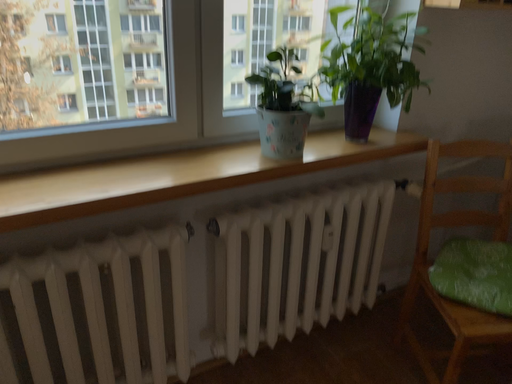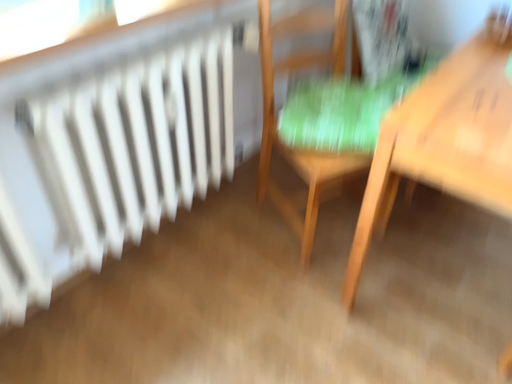
Question: Which way did the camera rotate in the video?

Choices:
 (A) rotated left
 (B) rotated right

Answer: (B)